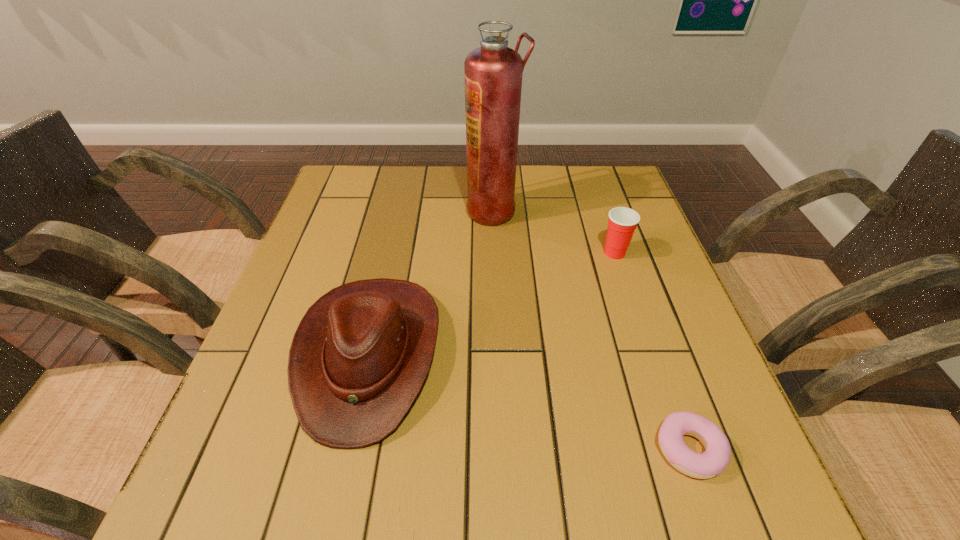
The width and height of the screenshot is (960, 540). Find the location of `the third object from right to left`. the third object from right to left is located at coordinates (493, 72).

Where is `fire extinguisher`? This screenshot has height=540, width=960. fire extinguisher is located at coordinates (493, 72).

You are a GUI agent. You are given a task and a screenshot of the screen. Output one action in this format:
    pyautogui.click(x=<x>, y=<y>)
    Task: Click on the Dixie cup
    The height and width of the screenshot is (540, 960).
    Given the screenshot: What is the action you would take?
    pyautogui.click(x=622, y=222)

I want to click on the leftmost object, so click(x=360, y=355).

Where is `the shortest object`? The width and height of the screenshot is (960, 540). the shortest object is located at coordinates (714, 460).

Where is `free space located on the side of the tallest object with the label`? free space located on the side of the tallest object with the label is located at coordinates (330, 211).

Identify the location of vacant region located 0.100m on the side of the tallest object with the label. The width and height of the screenshot is (960, 540). (431, 211).

The height and width of the screenshot is (540, 960). Identify the location of vacant region located 0.310m on the side of the tallest object with the label. (355, 211).

I want to click on vacant region located on the left of the Dixie cup, so click(x=528, y=253).

Locate an element on the screen. The width and height of the screenshot is (960, 540). free spot located 0.050m on the front-facing side of the leftmost object is located at coordinates (341, 481).